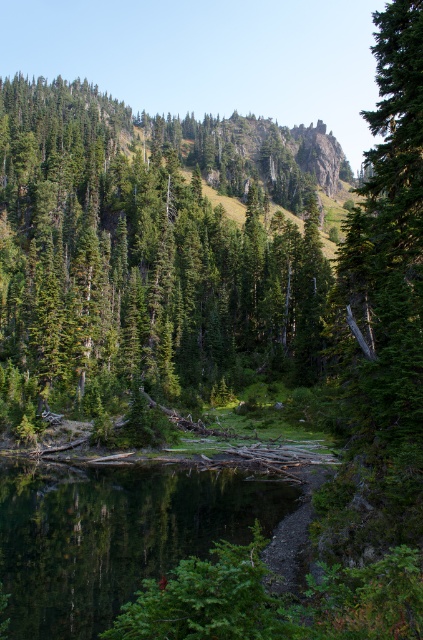
Question: Which of the following is the farthest from the observer?

Choices:
 (A) (41, 188)
 (B) (51, 566)

Answer: (A)

Question: Which point is farther to the camera?

Choices:
 (A) (32, 138)
 (B) (153, 500)

Answer: (A)

Question: Which object appears closest to the camera in this image?

Choices:
 (A) green matte tree at center
 (B) smooth reflective water at center

Answer: (B)

Question: Is green matte tree at center wider than smooth reflective water at center?

Choices:
 (A) no
 (B) yes

Answer: (B)

Question: Is green matte tree at center closer to the viewer compared to smooth reflective water at center?

Choices:
 (A) no
 (B) yes

Answer: (A)

Question: Does green matte tree at center appear under smooth reflective water at center?

Choices:
 (A) yes
 (B) no

Answer: (B)